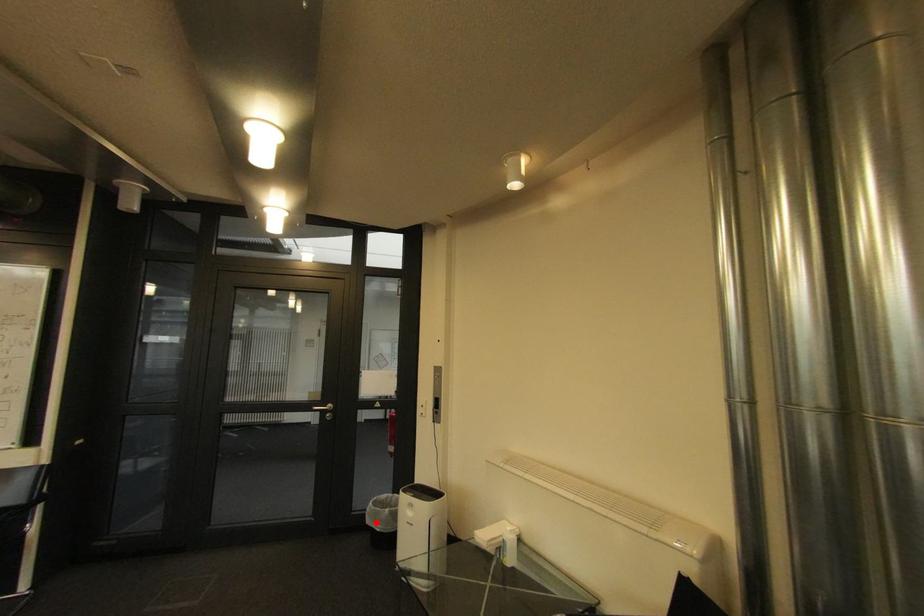
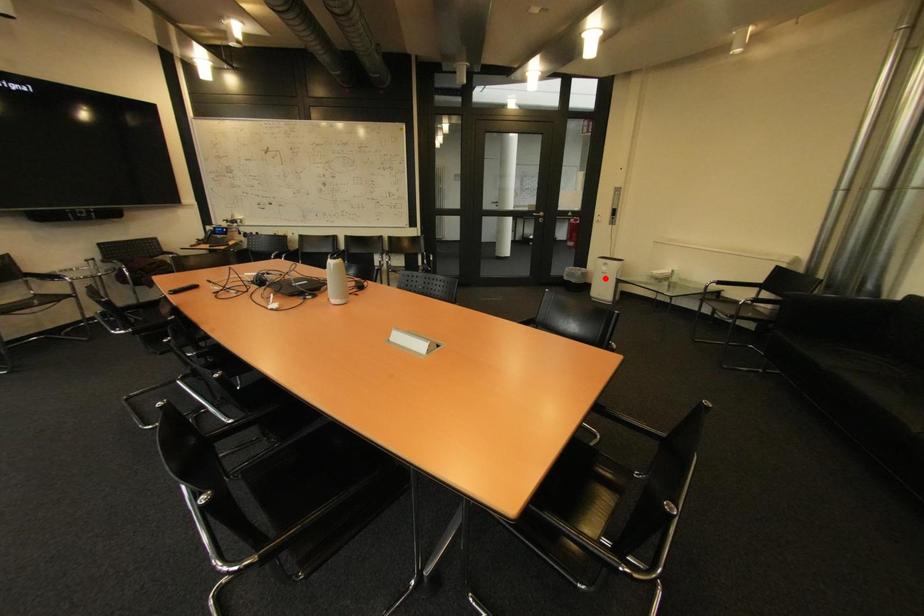
I am providing you with two images of the same scene from different viewpoints. A red point is marked on the first image and another point is marked on the second image. Are the points marked in image1 and image2 representing the same 3D position?

No